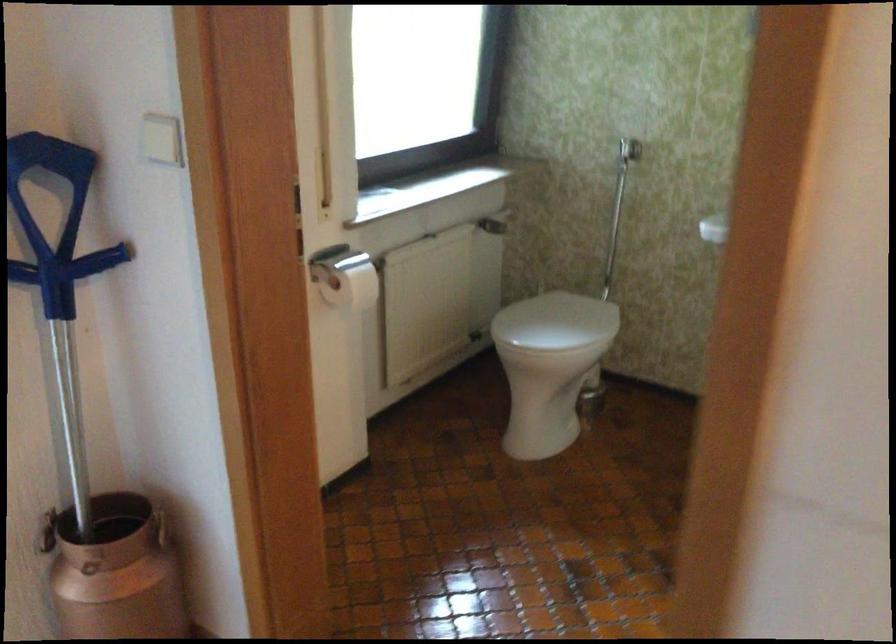
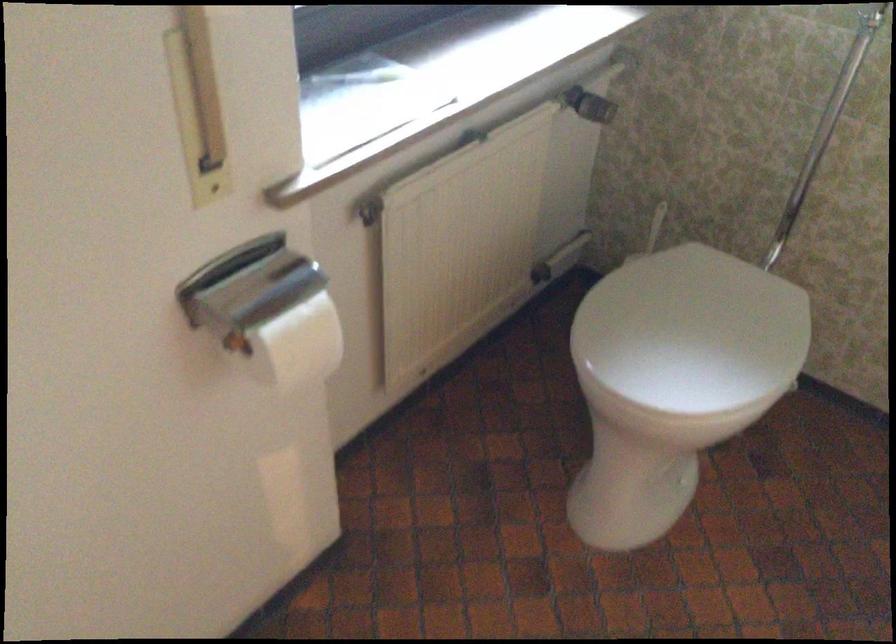
Where in the second image is the point corresponding to [323,270] from the first image?

(247, 285)